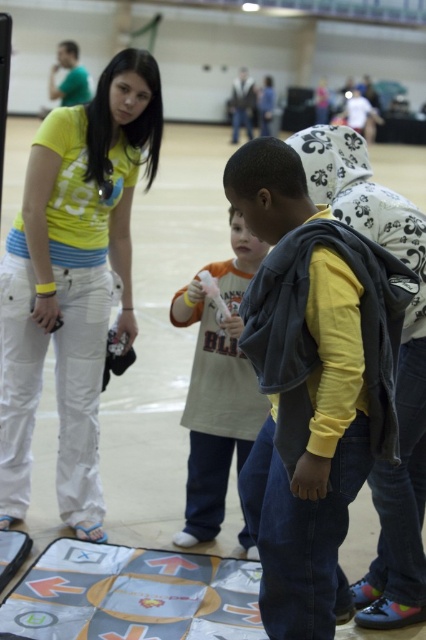
Question: Considering the real-world distances, which object is closest to the dark gray fleece vest at center?

Choices:
 (A) orange cotton shirt at center
 (B) yellow matte t-shirt at upper left

Answer: (A)

Question: Is the position of dark gray fleece vest at center less distant than that of orange cotton shirt at center?

Choices:
 (A) yes
 (B) no

Answer: (A)

Question: Estimate the real-world distances between objects in this image. Which object is closer to the dark gray fleece vest at center?

Choices:
 (A) yellow matte t-shirt at upper left
 (B) gray fabric mat at lower center

Answer: (B)

Question: Is yellow matte t-shirt at upper left below dark gray fleece vest at center?

Choices:
 (A) yes
 (B) no

Answer: (B)

Question: Does yellow matte t-shirt at upper left appear under gray fabric mat at lower center?

Choices:
 (A) yes
 (B) no

Answer: (B)

Question: Which point appears farthest from the camera in this image?

Choices:
 (A) (322, 416)
 (B) (31, 337)
 (C) (135, 593)

Answer: (B)